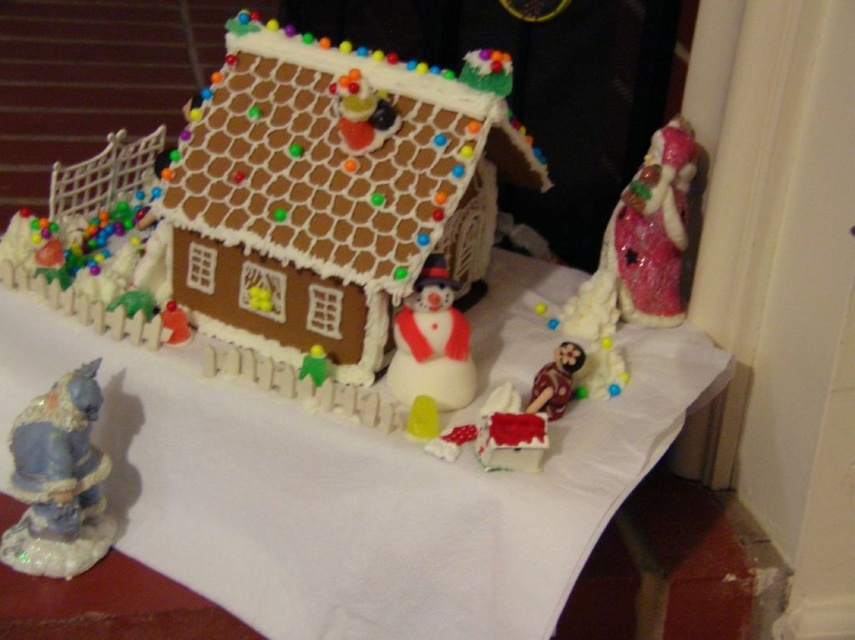
You are standing in front of the festive gingerbread house setup. You see a point marked at coordinates [296,221]. Which object does this point correspond to?

The point at coordinates [296,221] corresponds to the brown fondant house at center.

You are setting up a holiday display and have a brown fondant house at center and a white paper at center. Which object takes up more space in the display?

The white paper at center occupies more space than the brown fondant house at center.

You are a guest at a holiday party and notice a matte blue cat at lower left and a white matte snowman at center. Which object is closer to you?

The matte blue cat at lower left is closer to you because it is in front of the white matte snowman at center.